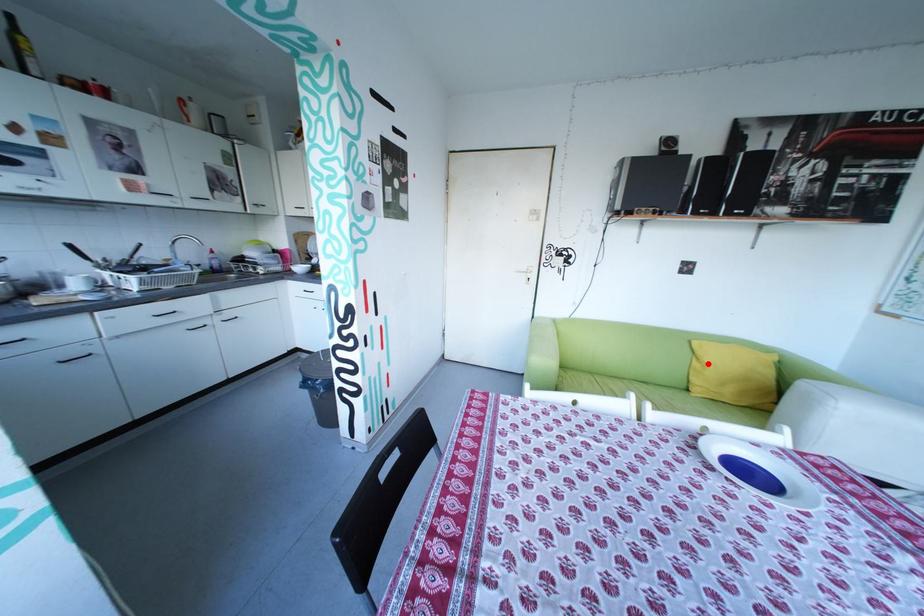
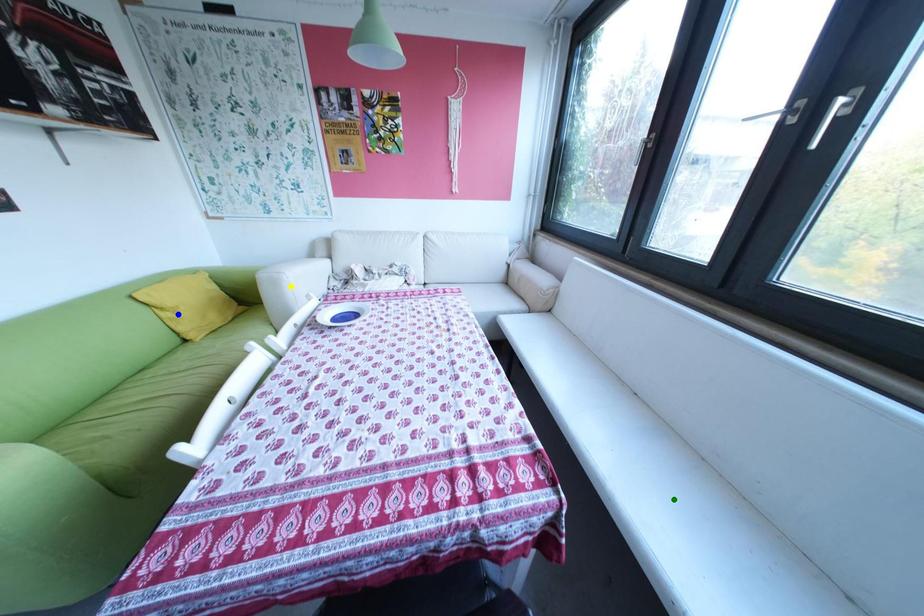
Question: I am providing you with two images of the same scene from different viewpoints. A red point is marked on the first image. You are given multiple points on the second image. In image 2, which mark is for the same physical point as the one in image 1?

Choices:
 (A) green point
 (B) blue point
 (C) yellow point

Answer: (B)